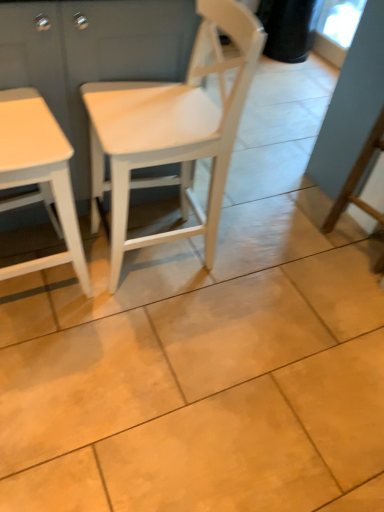
This screenshot has height=512, width=384. What do you see at coordinates (172, 130) in the screenshot? I see `white matte wood chair at center` at bounding box center [172, 130].

Describe the element at coordinates (39, 175) in the screenshot. The height and width of the screenshot is (512, 384). I see `white matte table at left` at that location.

Describe the element at coordinates (92, 57) in the screenshot. I see `white wood dresser at left` at that location.

Where is `white matte wood chair at center`? This screenshot has width=384, height=512. white matte wood chair at center is located at coordinates (172, 130).

Does point (14, 127) lie behind point (192, 98)?

No, it is in front of (192, 98).

From a real-world perspective, is white matte table at left positioned over white matte wood chair at center based on gravity?

Yes, from a real-world perspective, white matte table at left is on top of white matte wood chair at center.

Where is `chair located underneath the white matte table at left (from a real-world perspective)`? This screenshot has height=512, width=384. chair located underneath the white matte table at left (from a real-world perspective) is located at coordinates (172, 130).

Considering the sizes of objects white matte wood chair at center and white wood dresser at left in the image provided, who is smaller, white matte wood chair at center or white wood dresser at left?

white matte wood chair at center is smaller.

What's the angular difference between white matte wood chair at center and white wood dresser at left's facing directions?

There is a 89.8-degree angle between the facing directions of white matte wood chair at center and white wood dresser at left.

Is white matte wood chair at center beside white wood dresser at left?

white matte wood chair at center and white wood dresser at left are clearly separated.

From the image's perspective, which is above, white matte wood chair at center or white wood dresser at left?

white wood dresser at left appears higher in the image.

Can you see white wood dresser at left touching white matte wood chair at center?

No, white wood dresser at left is not beside white matte wood chair at center.

Is white wood dresser at left taller than white matte wood chair at center?

Incorrect, the height of white wood dresser at left is not larger of that of white matte wood chair at center.

Can we say white wood dresser at left lies outside white matte wood chair at center?

Indeed, white wood dresser at left is completely outside white matte wood chair at center.

Which object is thinner, white wood dresser at left or white matte wood chair at center?

white matte wood chair at center is thinner.

Is white wood dresser at left completely or partially outside of white matte table at left?

Yes, white wood dresser at left is not within white matte table at left.

From the picture: Considering the positions of objects white wood dresser at left and white matte table at left in the image provided, who is in front, white wood dresser at left or white matte table at left?

white matte table at left is in front.

Considering the relative positions of white wood dresser at left and white matte table at left in the image provided, is white wood dresser at left to the right of white matte table at left from the viewer's perspective?

Indeed, white wood dresser at left is positioned on the right side of white matte table at left.

This screenshot has width=384, height=512. Find the location of `dresser beneath the white matte table at left (from a real-world perspective)`. dresser beneath the white matte table at left (from a real-world perspective) is located at coordinates 92,57.

Is white matte wood chair at center spatially inside white matte table at left, or outside of it?

white matte wood chair at center is not inside white matte table at left, it's outside.

Measure the distance between white matte wood chair at center and white matte table at left.

white matte wood chair at center and white matte table at left are 11.87 inches apart from each other.

Is white matte wood chair at center far away from white matte table at left?

white matte wood chair at center is actually quite close to white matte table at left.

Looking at this image, between white matte wood chair at center and white matte table at left, which one appears on the right side from the viewer's perspective?

white matte wood chair at center.

In order to click on table lying in front of the white wood dresser at left in this screenshot , I will do `click(39, 175)`.

Is white wood dresser at left a part of white matte table at left?

No, white wood dresser at left is not inside white matte table at left.

Between white matte table at left and white wood dresser at left, which one is positioned in front?

white matte table at left is closer to the camera.

Between point (9, 173) and point (151, 198), which one is positioned in front?

The point (9, 173) is more forward.

Identify the location of chair lying on the right of white matte table at left. The height and width of the screenshot is (512, 384). (172, 130).

At what (x,y) coordinates should I click in order to perform the action: click on dresser that is on the left side of white matte wood chair at center. Please return your answer as a coordinate pair (x, y). This screenshot has width=384, height=512. Looking at the image, I should click on tap(92, 57).

From the image, which object appears to be farther from white matte wood chair at center, white matte table at left or white wood dresser at left?

white matte table at left is further to white matte wood chair at center.

When comparing their distances from white wood dresser at left, does white matte table at left or white matte wood chair at center seem closer?

white matte wood chair at center.

Which object lies nearer to the anchor point white matte table at left, white matte wood chair at center or white wood dresser at left?

white wood dresser at left.

Consider the image. From the image, which object appears to be farther from white matte wood chair at center, white wood dresser at left or white matte table at left?

white matte table at left.

When comparing their distances from white matte table at left, does white wood dresser at left or white matte wood chair at center seem further?

white matte wood chair at center is positioned further to the anchor white matte table at left.

Which object lies further to the anchor point white wood dresser at left, white matte wood chair at center or white matte table at left?

Based on the image, white matte table at left appears to be further to white wood dresser at left.

The height and width of the screenshot is (512, 384). I want to click on chair between white wood dresser at left and white matte table at left in the up-down direction, so click(x=172, y=130).